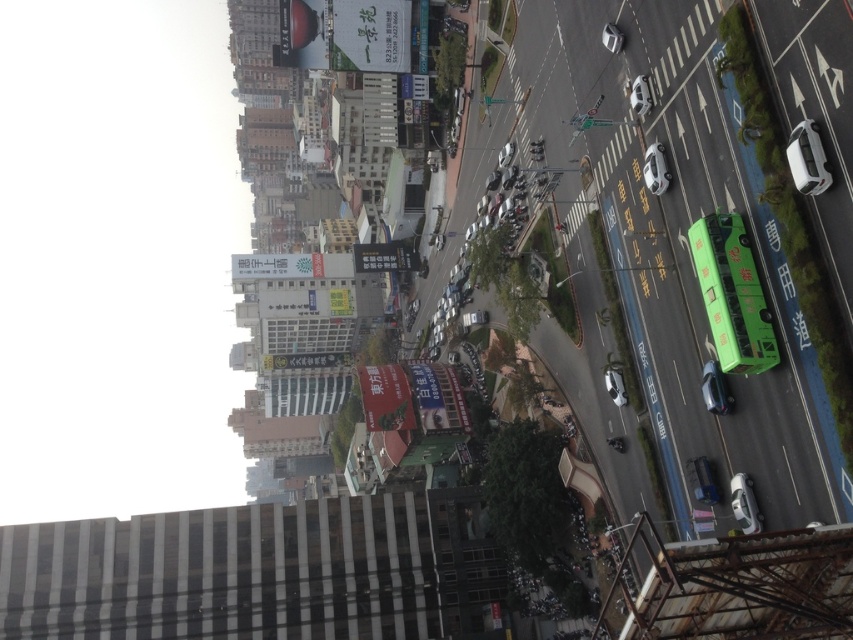
You are a delivery drone operator. Your drone is currently at the center of the image, and you need to deliver a package to the white glossy car at lower right. According to the coordinates provided, in which direction should you fly your drone to reach the car?

The white glossy car at lower right is located at coordinates point (744, 504). Since the drone is at the center, it should fly towards the lower right direction to reach the car.

You are a pedestrian standing at the intersection looking towards the road. You see two cars at the upper right corner of the road. Which car is positioned more to the right between the white matte car at upper right and the white glossy car at upper right?

The white matte car at upper right is positioned more to the right compared to the white glossy car at upper right.